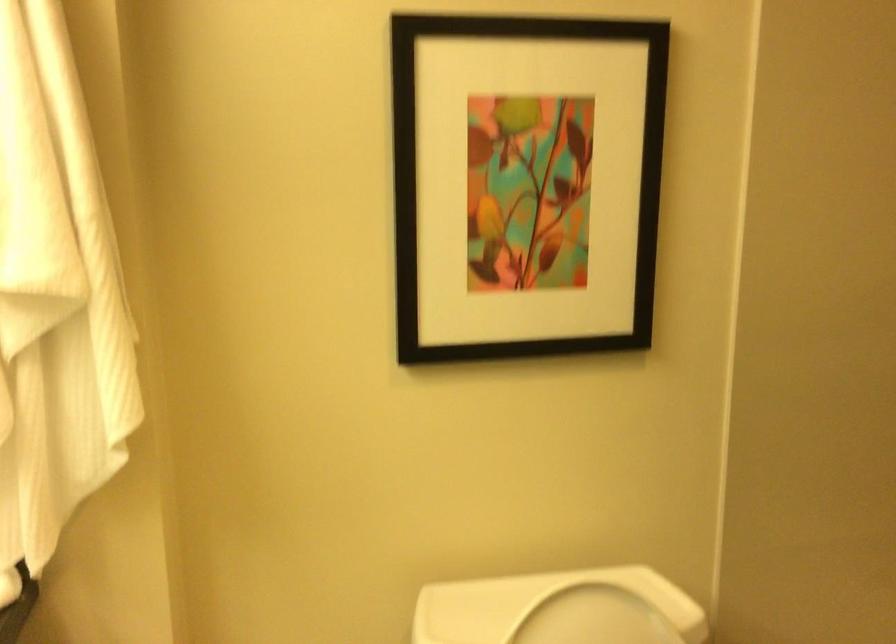
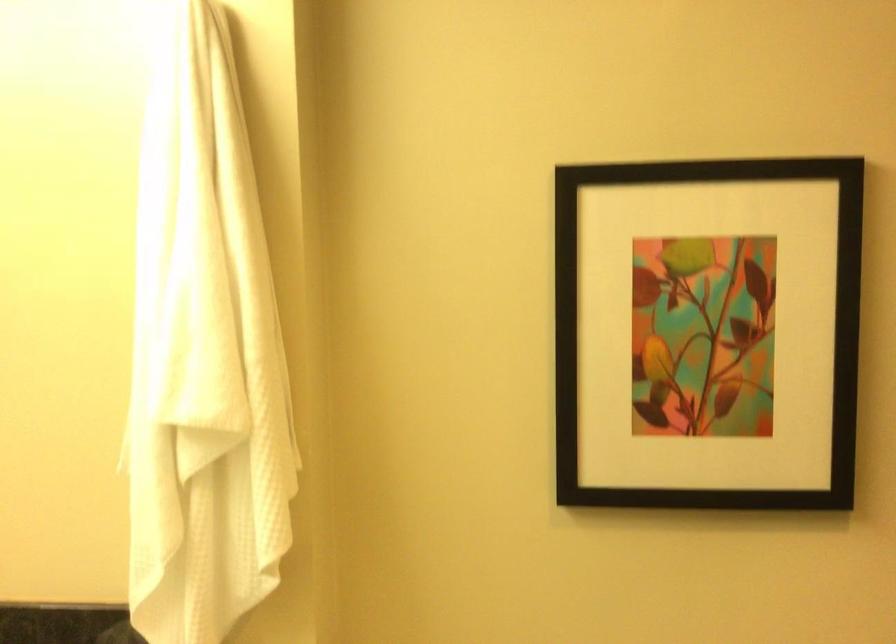
Question: Which direction would the cameraman need to move to produce the second image? Reply with the corresponding letter.

Choices:
 (A) Left
 (B) Right
 (C) Forward
 (D) Backward

Answer: (B)